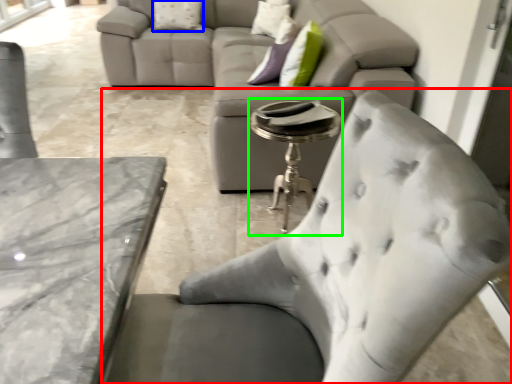
Question: Which object is the closest to the chair (highlighted by a red box)? Choose among these: pillow (highlighted by a blue box) or side table (highlighted by a green box).

Choices:
 (A) pillow
 (B) side table

Answer: (B)